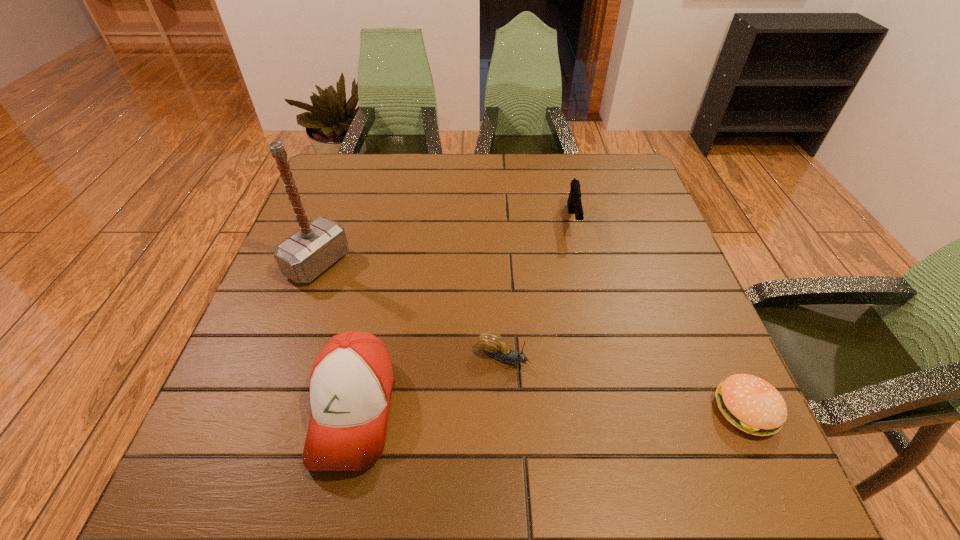
Where is `free location located on the striking surface of the hammer`? The image size is (960, 540). free location located on the striking surface of the hammer is located at coordinates (417, 319).

You are a GUI agent. You are given a task and a screenshot of the screen. Output one action in this format:
    pyautogui.click(x=<x>, y=<y>)
    Task: Click on the free spot located 0.310m on the striking surface of the hammer
    The image size is (960, 540).
    Given the screenshot: What is the action you would take?
    pyautogui.click(x=447, y=335)

This screenshot has width=960, height=540. In order to click on vacant space located on the front-facing side of the third shortest object in this screenshot , I will do `click(593, 355)`.

Locate an element on the screen. vacant area situated 0.370m on the front-facing side of the third shortest object is located at coordinates (595, 369).

Locate an element on the screen. The image size is (960, 540). free spot located on the front-facing side of the third shortest object is located at coordinates (592, 352).

Identify the location of free location located 0.120m on the front-facing side of the escargot. (584, 394).

You are a GUI agent. You are given a task and a screenshot of the screen. Output one action in this format:
    pyautogui.click(x=<x>, y=<y>)
    Task: Click on the vacant space positioned on the front-facing side of the escargot
    
    Given the screenshot: What is the action you would take?
    pyautogui.click(x=636, y=421)

This screenshot has height=540, width=960. Find the location of `blank space located on the front-facing side of the escargot`. blank space located on the front-facing side of the escargot is located at coordinates (648, 427).

Where is `baseball cap that is at the near edge`? Image resolution: width=960 pixels, height=540 pixels. baseball cap that is at the near edge is located at coordinates point(351,383).

The image size is (960, 540). What are the coordinates of `patty that is at the near edge` in the screenshot? It's located at (x=751, y=404).